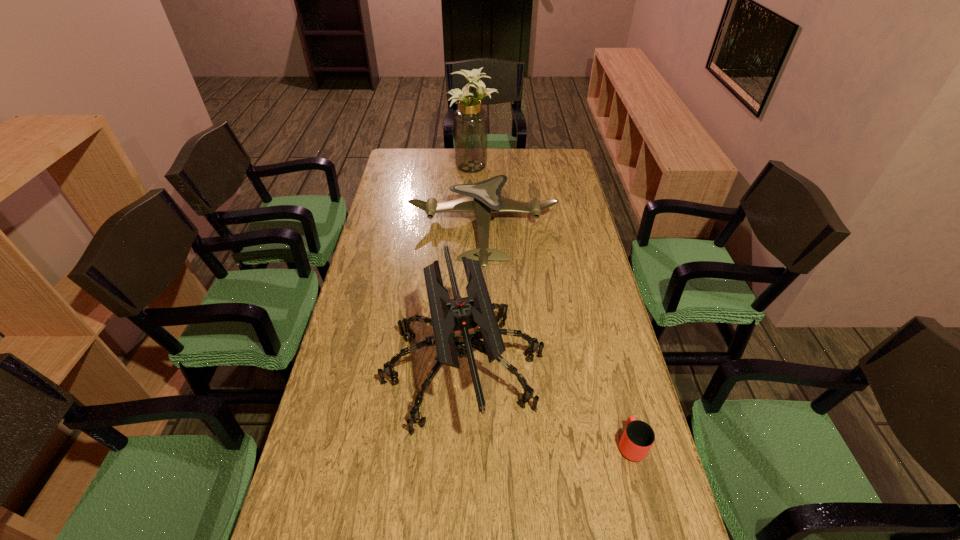
In the image, there is a desktop. Where is `free space at the far left corner`? The width and height of the screenshot is (960, 540). free space at the far left corner is located at coordinates [x=405, y=172].

Image resolution: width=960 pixels, height=540 pixels. In the image, there is a desktop. Find the location of `vacant space at the far right corner`. vacant space at the far right corner is located at coordinates (547, 166).

Identify the location of free space between the shortest object and the farther drone. (557, 336).

Where is `free space between the cup and the tallest object`? free space between the cup and the tallest object is located at coordinates (552, 305).

Where is `object that ranks as the second closest to the shortest object`? The height and width of the screenshot is (540, 960). object that ranks as the second closest to the shortest object is located at coordinates (483, 198).

Choose which object is the second nearest neighbor to the rightmost object. Please provide its 2D coordinates. Your answer should be formatted as a tuple, i.e. [(x, y)], where the tuple contains the x and y coordinates of a point satisfying the conditions above.

[(483, 198)]